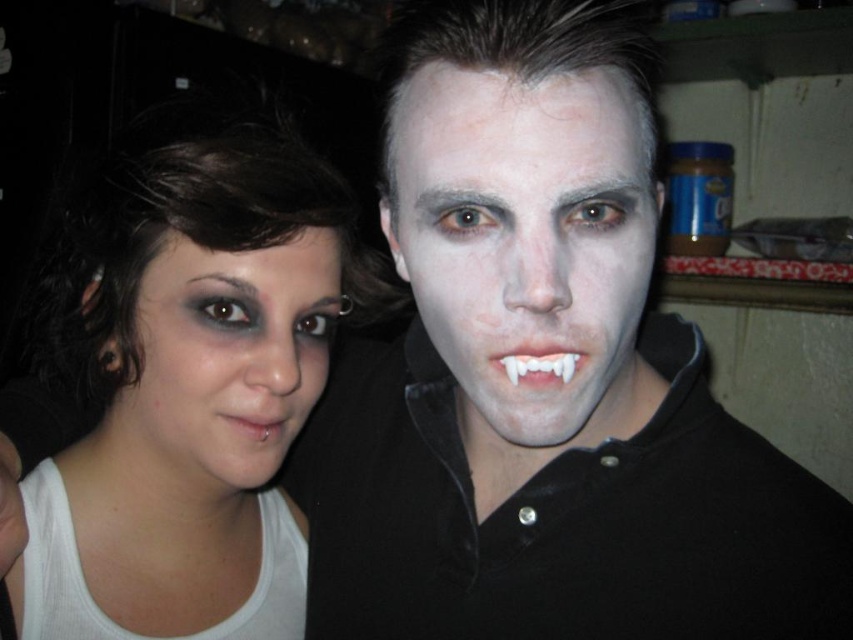
Based on the photo, between white matte face paint at center and white matte skin at center, which one has less height?

Standing shorter between the two is white matte face paint at center.

Who is more forward, (756,518) or (62,547)?

Point (756,518) is more forward.

You are a GUI agent. You are given a task and a screenshot of the screen. Output one action in this format:
    pyautogui.click(x=<x>, y=<y>)
    Task: Click on the white matte face paint at center
    This screenshot has height=640, width=853.
    Given the screenshot: What is the action you would take?
    pyautogui.click(x=543, y=380)

Does white matte face paint at center have a smaller size compared to pierced flesh at lower center?

No, white matte face paint at center is not smaller than pierced flesh at lower center.

Who is more forward, (624,182) or (258,422)?

Point (624,182) is more forward.

The width and height of the screenshot is (853, 640). In order to click on white matte face paint at center in this screenshot , I will do `click(543, 380)`.

Does white matte face at center have a smaller size compared to matte black eye makeup at center?

No.

Is point (637, 230) closer to camera compared to point (137, 330)?

Yes, it is.

Find the location of `white matte face at center`. white matte face at center is located at coordinates (527, 246).

The height and width of the screenshot is (640, 853). I want to click on white matte face at center, so click(x=527, y=246).